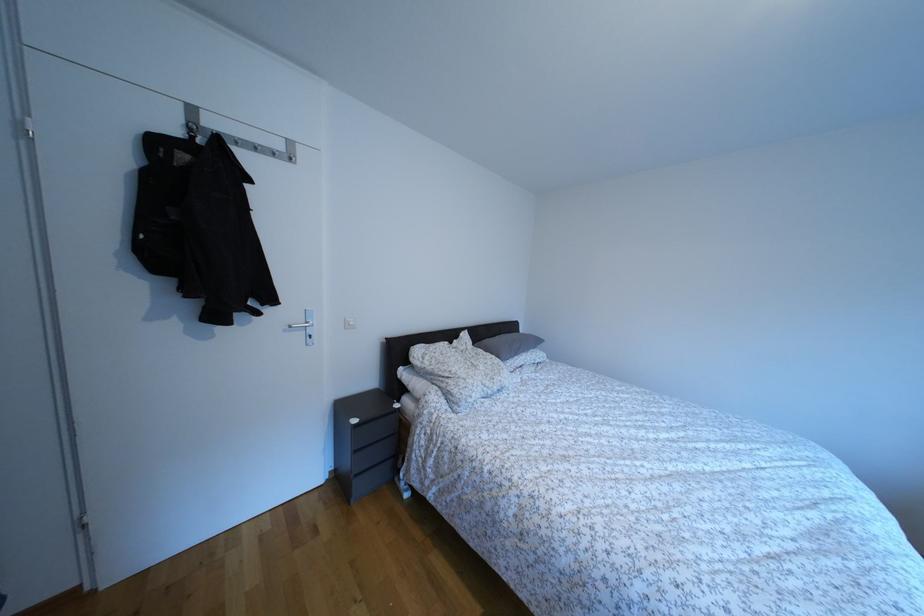
Describe the element at coordinates (302, 325) in the screenshot. I see `the silver door handle` at that location.